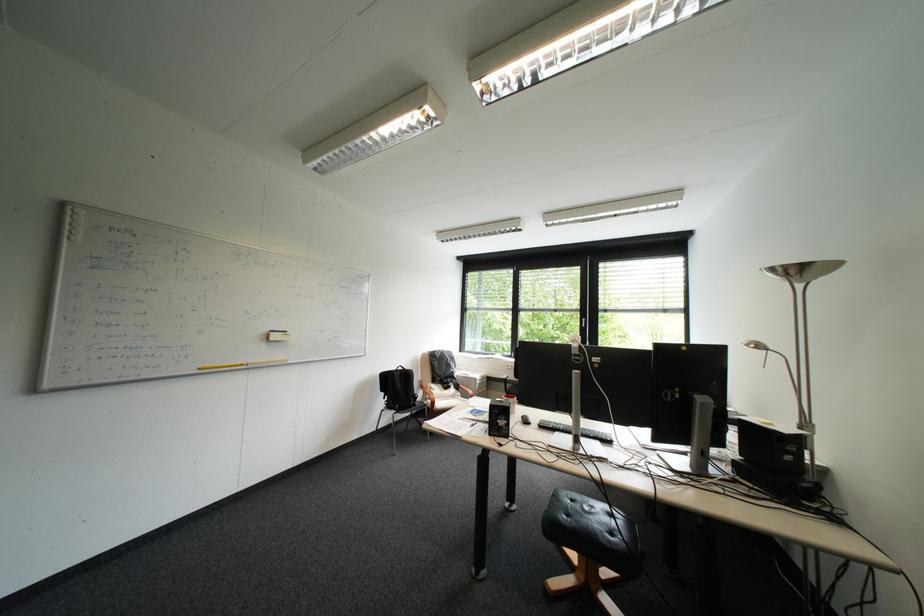
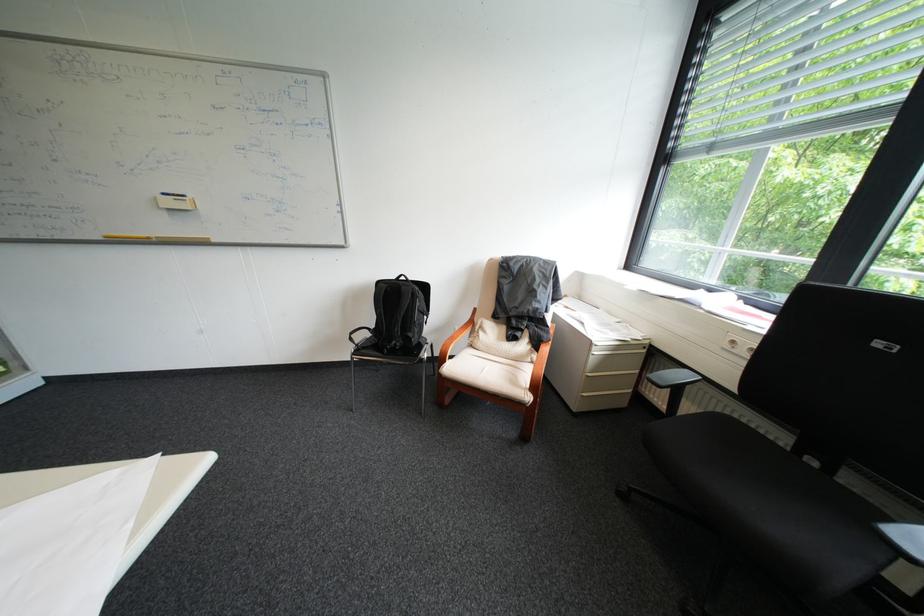
Locate, in the second image, the point that corresponds to (x=519, y=367) in the first image.

(746, 342)